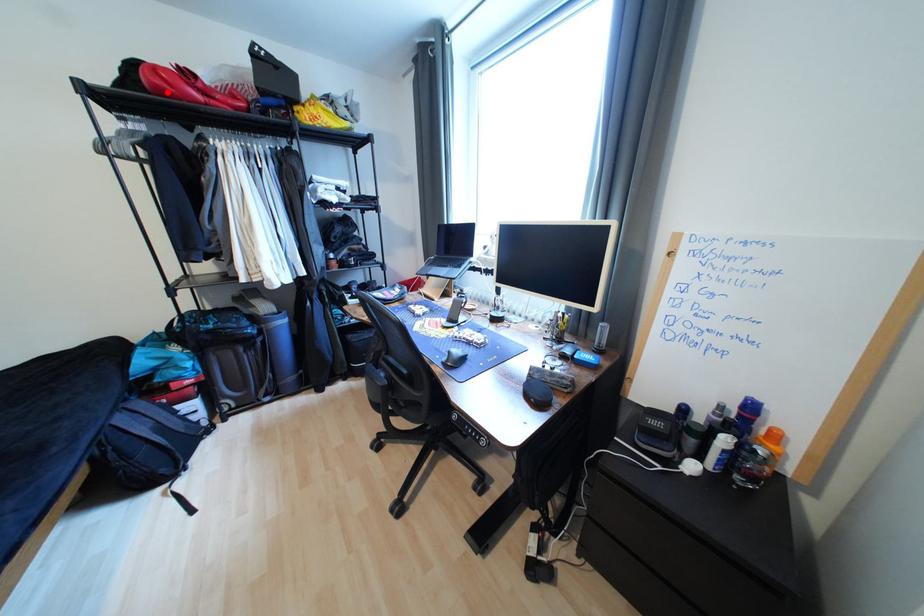
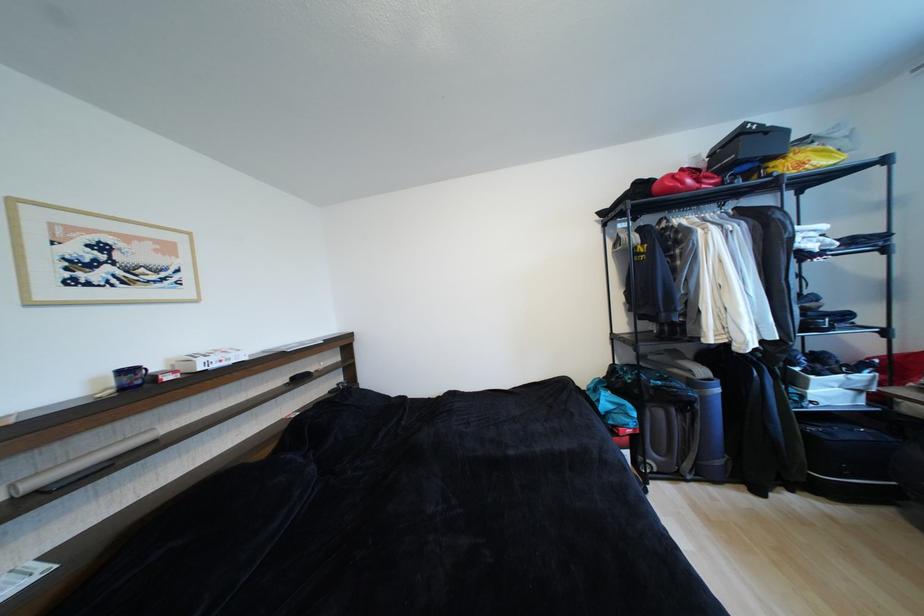
Find the pixel in the second image that matches the highlighted location in the first image.

(676, 192)